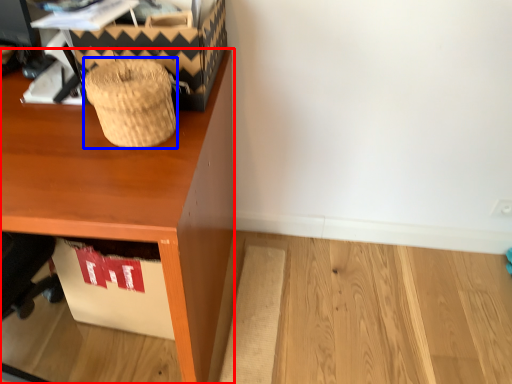
Question: Among these objects, which one is farthest to the camera, desk (highlighted by a red box) or basket (highlighted by a blue box)?

Choices:
 (A) desk
 (B) basket

Answer: (B)